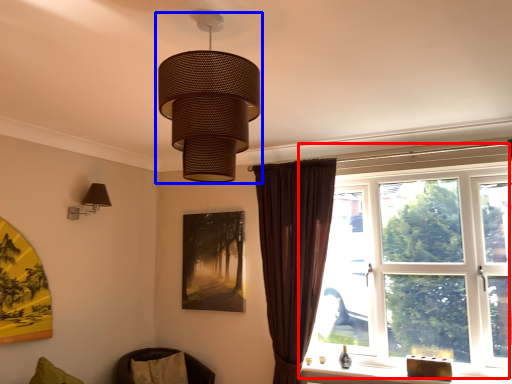
Question: Which object is further to the camera taking this photo, window (highlighted by a red box) or lamp (highlighted by a blue box)?

Choices:
 (A) window
 (B) lamp

Answer: (A)